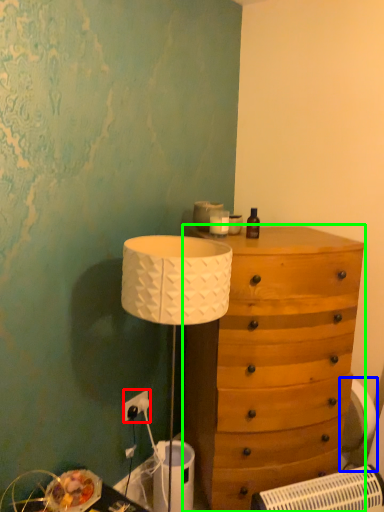
Question: Which is nearer to the electric outlet (highlighted by a red box)? swivel chair (highlighted by a blue box) or chest of drawers (highlighted by a green box).

Choices:
 (A) swivel chair
 (B) chest of drawers

Answer: (B)